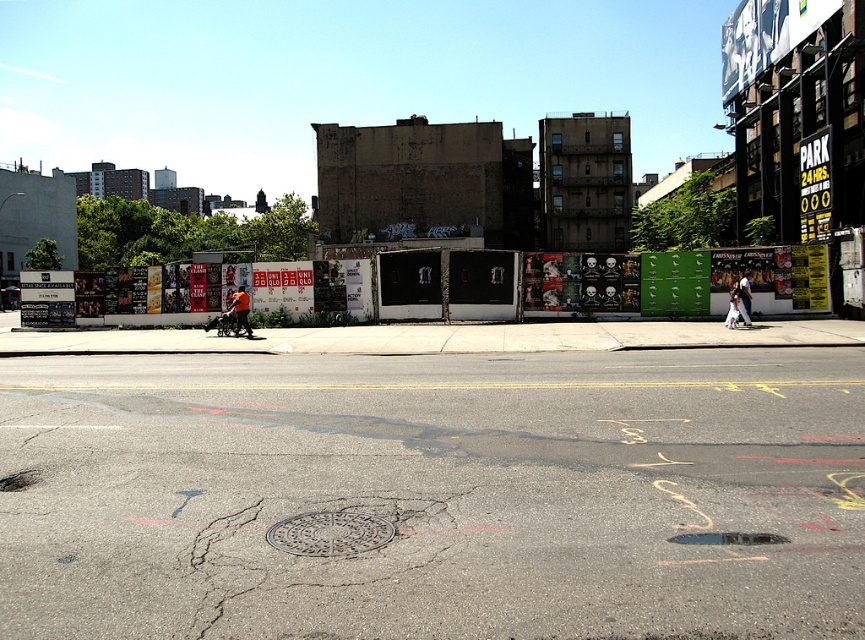
You are a delivery person trying to navigate through the sidewalk in the urban street scene. You see an orange fabric stroller at center and a white cotton shirt at center. Which object is taller and could potentially block your delivery cart that is 1.2 meters in height?

The orange fabric stroller at center is taller than the white cotton shirt at center. Since the delivery cart is 1.2 meters tall, you should check the height of the orange fabric stroller at center to ensure it doesn not obstruct your path.